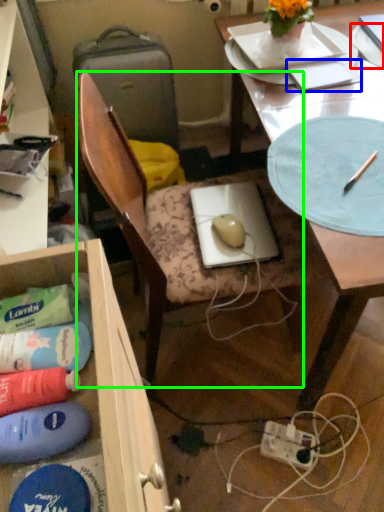
Question: Which object is positioned closest to paper plate (highlighted by a red box)? Select from notepad (highlighted by a blue box) and chair (highlighted by a green box).

Choices:
 (A) notepad
 (B) chair

Answer: (A)